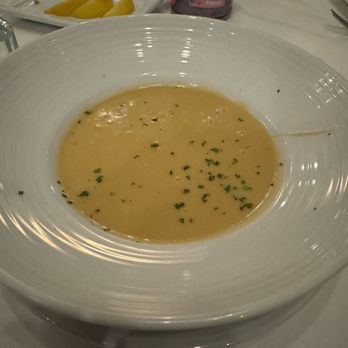
I want to click on table cloth, so click(321, 322).